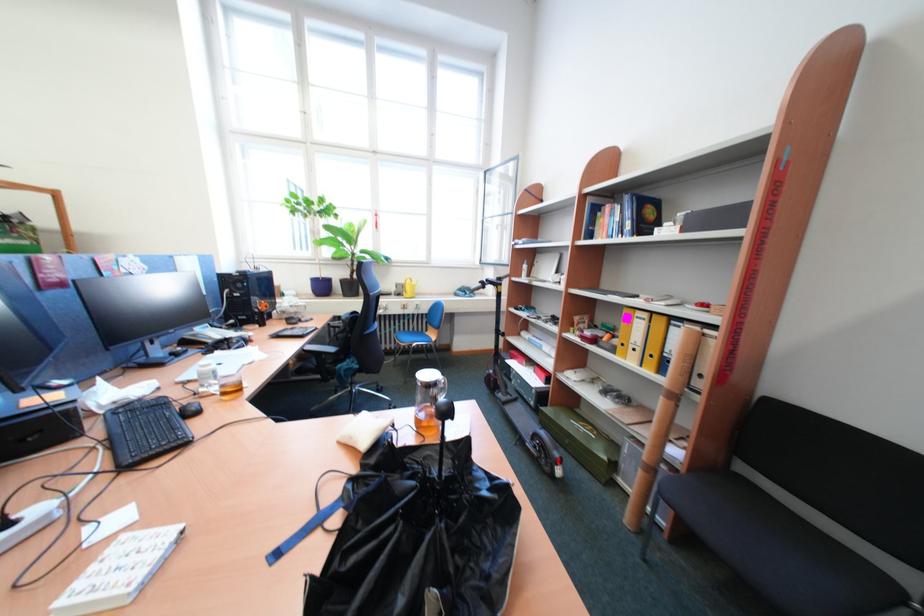
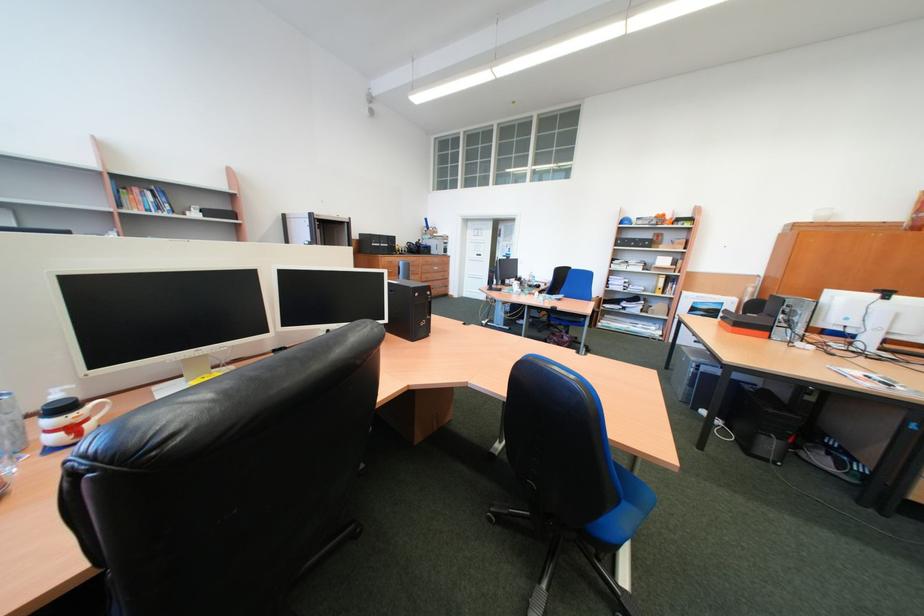
The point at (x=603, y=238) is marked in the first image. Where is the corresponding point in the second image?

(134, 207)